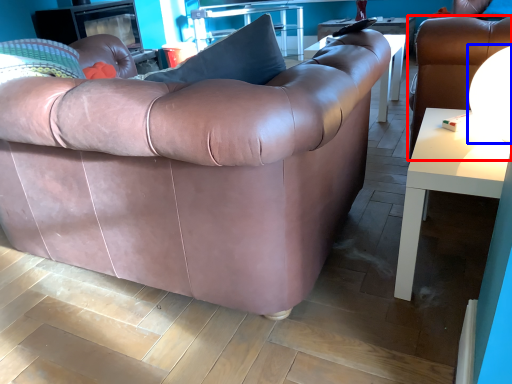
Question: Which of the following is the farthest to the observer, chair (highlighted by a red box) or lamp (highlighted by a blue box)?

Choices:
 (A) chair
 (B) lamp

Answer: (A)